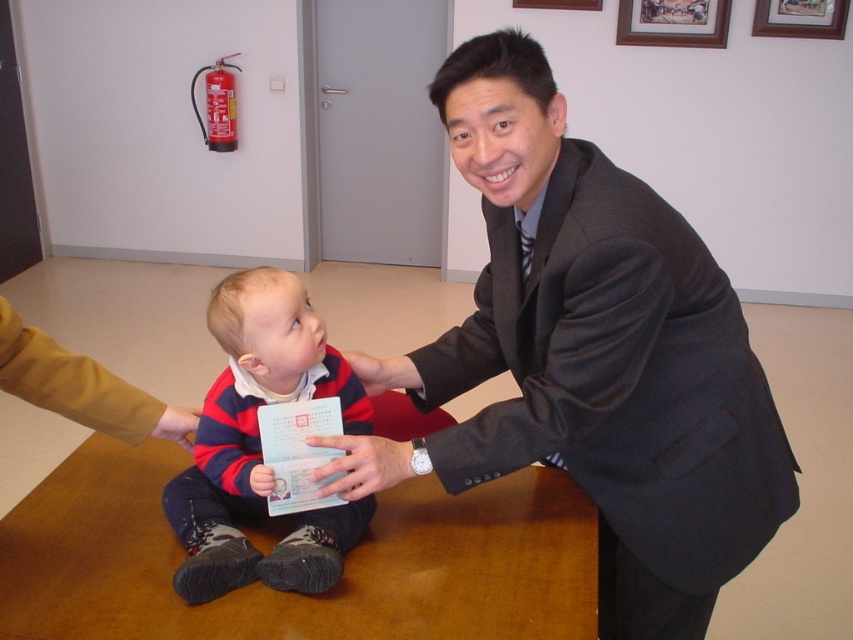
You are standing at the origin point of the image. Where is the dark gray suit at center located?

The dark gray suit at center is located at point 0.553 on the x axis and 0.702 on the y axis.

You are an observer in the scene. You notice the dark gray suit at center and the smooth skin hand at center. Which object is positioned higher in the image?

The dark gray suit at center is located above the smooth skin hand at center, so it is positioned higher in the image.